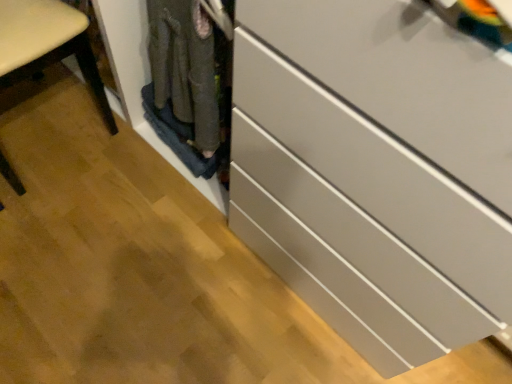
Question: In terms of size, does matte wood chair at left appear bigger or smaller than white glossy chest of drawers at center?

Choices:
 (A) small
 (B) big

Answer: (A)

Question: Is matte wood chair at left situated inside white glossy chest of drawers at center or outside?

Choices:
 (A) outside
 (B) inside

Answer: (A)

Question: Is point (61, 28) positioned closer to the camera than point (242, 238)?

Choices:
 (A) closer
 (B) farther

Answer: (A)

Question: Based on their positions, is white glossy chest of drawers at center located to the left or right of matte wood chair at left?

Choices:
 (A) left
 (B) right

Answer: (B)

Question: From the image's perspective, is white glossy chest of drawers at center above or below matte wood chair at left?

Choices:
 (A) above
 (B) below

Answer: (B)

Question: In terms of width, does white glossy chest of drawers at center look wider or thinner when compared to matte wood chair at left?

Choices:
 (A) thin
 (B) wide

Answer: (B)

Question: Would you say white glossy chest of drawers at center is inside or outside matte wood chair at left?

Choices:
 (A) outside
 (B) inside

Answer: (A)